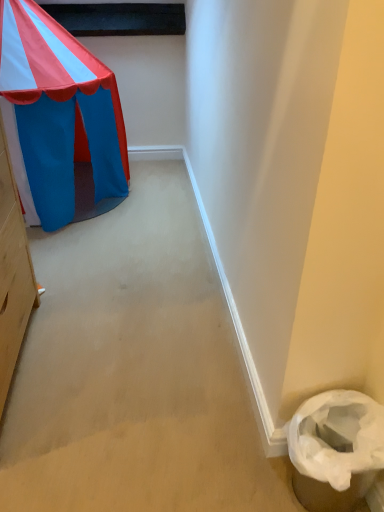
Locate an element on the screen. Image resolution: width=384 pixels, height=512 pixels. brown textured trash can at lower right is located at coordinates (335, 449).

The width and height of the screenshot is (384, 512). What do you see at coordinates (335, 449) in the screenshot? I see `brown textured trash can at lower right` at bounding box center [335, 449].

In order to face brown textured trash can at lower right, should I rotate leftwards or rightwards?

To align with it, rotate right about 18.017°.

Measure the distance between point [346,403] and camera.

The depth of point [346,403] is 3.60 feet.

Find the location of a particular element. This screenshot has height=512, width=384. brown textured trash can at lower right is located at coordinates (335, 449).